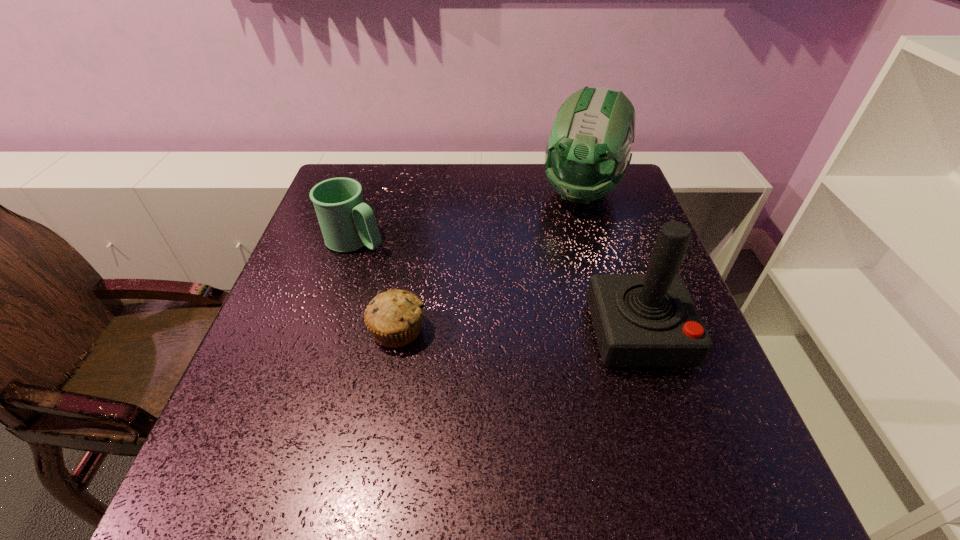
Identify the location of empty space between the second object from left to right and the mug. Image resolution: width=960 pixels, height=540 pixels. (376, 286).

Where is `unoccupied position between the muffin and the joystick`? unoccupied position between the muffin and the joystick is located at coordinates (517, 332).

Locate an element on the screen. Image resolution: width=960 pixels, height=540 pixels. vacant area that lies between the shortest object and the football helmet is located at coordinates point(490,261).

This screenshot has height=540, width=960. Identify the location of free space between the joystick and the farthest object. (610, 263).

This screenshot has height=540, width=960. Identify the location of vacant space that's between the third nearest object and the joystick. (497, 287).

The height and width of the screenshot is (540, 960). What are the coordinates of `free space between the joystick and the third tallest object` in the screenshot? It's located at (497, 287).

Locate which object ranks third in proximity to the second shortest object. Please provide its 2D coordinates. Your answer should be formatted as a tuple, i.e. [(x, y)], where the tuple contains the x and y coordinates of a point satisfying the conditions above.

[(640, 320)]

Identify the location of object that is the closest one to the joystick. (588, 150).

Find the location of a particular element. vacant region that satisfies the following two spatial constraints: 1. on the front side of the third tallest object; 2. on the right side of the shortest object is located at coordinates (327, 330).